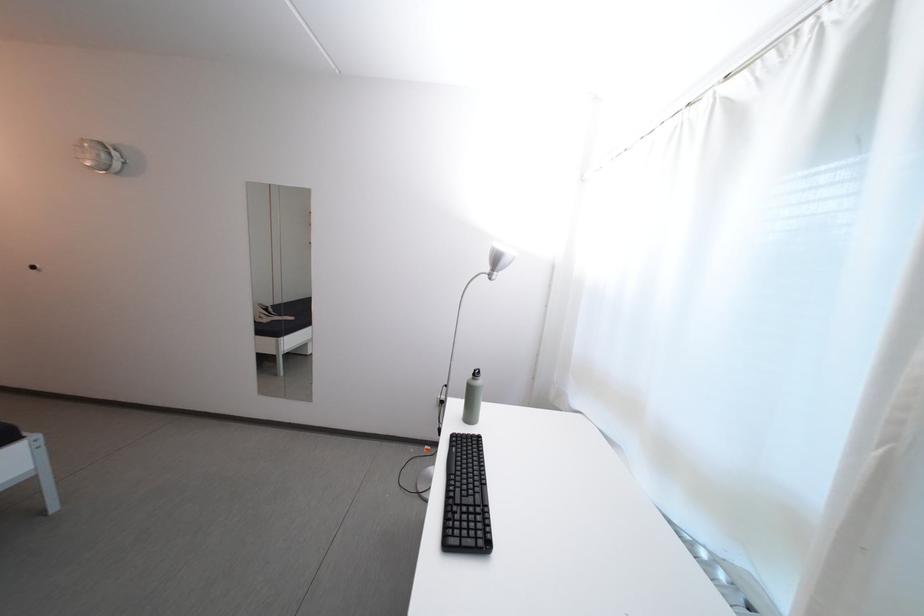
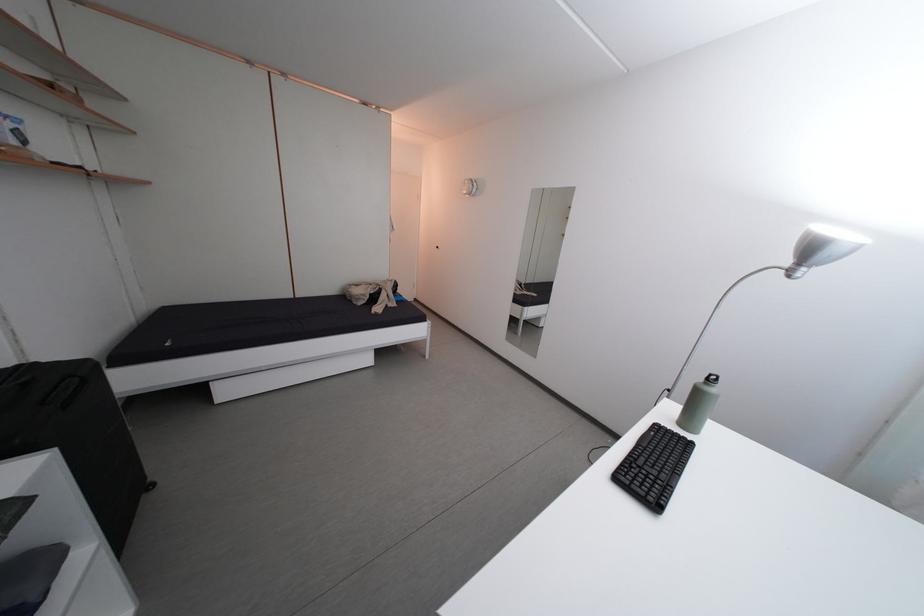
Where in the second image is the point corresponding to the point at 456,551 from the first image?

(626, 485)